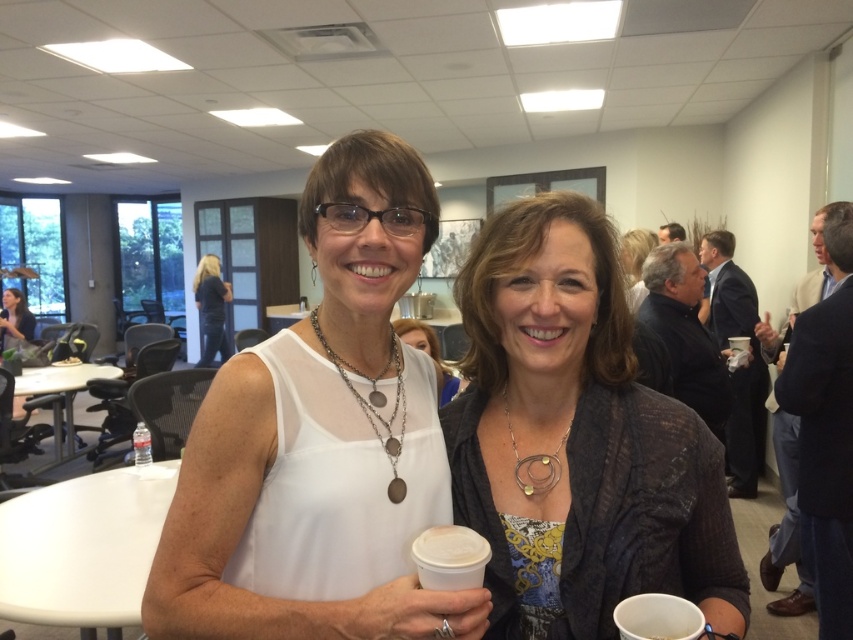
Question: Which object is positioned farthest from the dark blue shirt at center?

Choices:
 (A) white matte tank top at center
 (B) white matte cup at center
 (C) matte black jacket at center
 (D) matte black laptop at left

Answer: (B)

Question: Which object appears farthest from the camera in this image?

Choices:
 (A) matte black laptop at left
 (B) matte black hair at upper right

Answer: (A)

Question: Does white matte cup at center appear on the right side of matte black hair at upper right?

Choices:
 (A) no
 (B) yes

Answer: (A)

Question: Does white paper cup at lower center lie behind dark blue shirt at center?

Choices:
 (A) no
 (B) yes

Answer: (A)

Question: Estimate the real-world distances between objects in this image. Which object is closer to the white matte tank top at center?

Choices:
 (A) matte black laptop at left
 (B) white matte cup at center
 (C) matte silver necklace at center

Answer: (B)

Question: Can you confirm if dark blue shirt at center is positioned below matte black laptop at left?

Choices:
 (A) yes
 (B) no

Answer: (B)